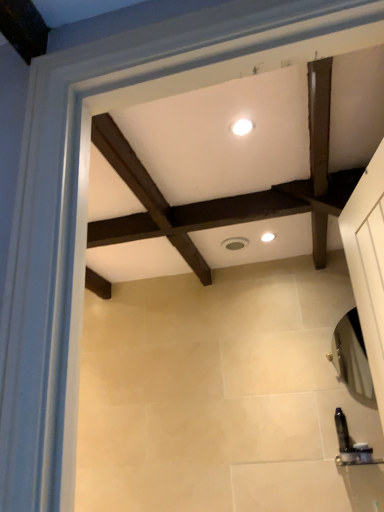
Question: From the image's perspective, relative to white glossy light fixture at upper center, positioned as the 1th lighting in left-to-right order, is black plastic toiletry at lower right, acting as the 2th toiletry starting from the right, above or below?

Choices:
 (A) below
 (B) above

Answer: (A)

Question: Relative to white glossy light fixture at upper center, positioned as the 1th lighting in left-to-right order, is black plastic toiletry at lower right, acting as the 2th toiletry starting from the right, in front or behind?

Choices:
 (A) behind
 (B) front

Answer: (A)

Question: Estimate the real-world distances between objects in this image. Which object is closer to the white glossy light fixture at center, the second lighting when ordered from top to bottom?

Choices:
 (A) white glossy light fixture at upper center, the second lighting in the bottom-to-top sequence
 (B) black plastic toiletry at lower right, acting as the 2th toiletry starting from the right
 (C) translucent plastic soap dispenser at lower right, which appears as the 2th toiletry when viewed from the left

Answer: (A)

Question: Considering the real-world distances, which object is farthest from the black plastic toiletry at lower right, acting as the 2th toiletry starting from the right?

Choices:
 (A) white glossy light fixture at center, the second lighting from the left
 (B) white glossy light fixture at upper center, positioned as the 1th lighting in left-to-right order
 (C) translucent plastic soap dispenser at lower right, which is the first toiletry from right to left

Answer: (B)